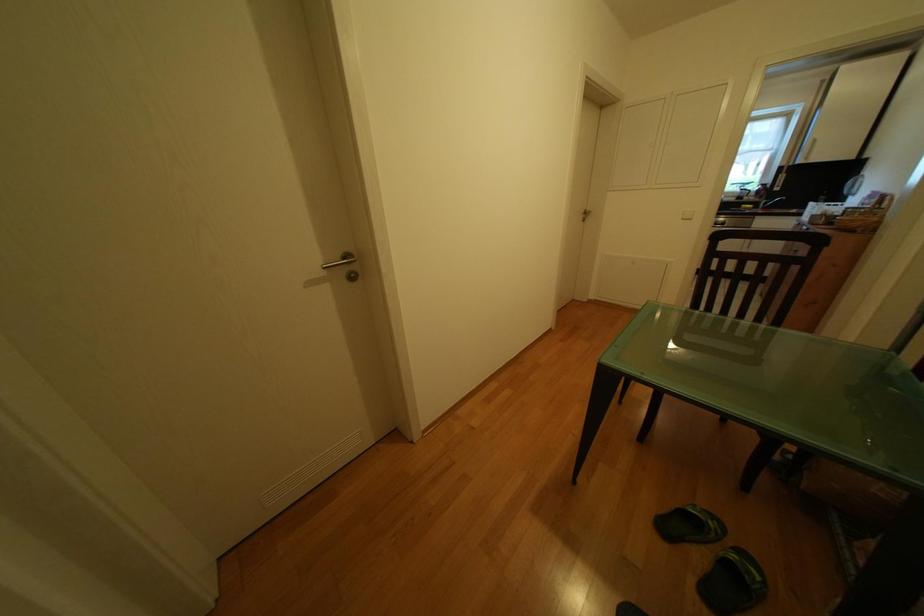
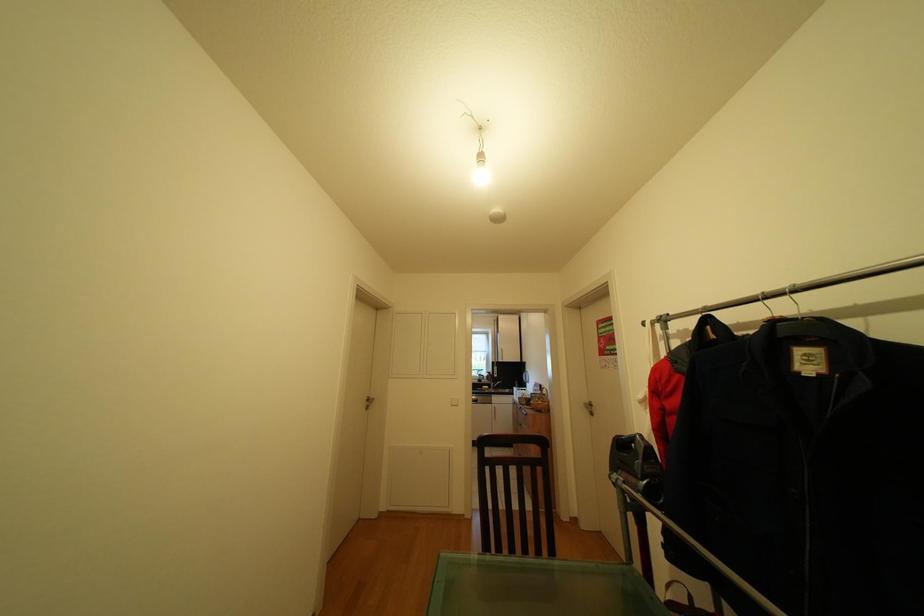
First-person continuous shooting, in which direction is the camera rotating?

The camera rotated toward right-up.